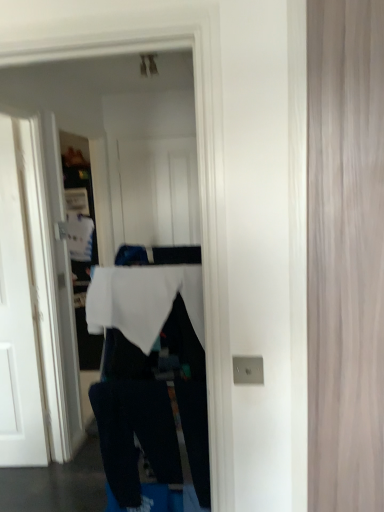
Question: From the image's perspective, is white matte tablecloth at center above wooden door at right?

Choices:
 (A) yes
 (B) no

Answer: (B)

Question: Can you confirm if white matte tablecloth at center is taller than wooden door at right?

Choices:
 (A) yes
 (B) no

Answer: (B)

Question: Is white matte tablecloth at center surrounding wooden door at right?

Choices:
 (A) no
 (B) yes

Answer: (A)

Question: Is wooden door at right at the back of white matte tablecloth at center?

Choices:
 (A) yes
 (B) no

Answer: (B)

Question: Considering the relative positions of white matte tablecloth at center and wooden door at right in the image provided, is white matte tablecloth at center behind wooden door at right?

Choices:
 (A) yes
 (B) no

Answer: (A)

Question: From the image's perspective, is white matte tablecloth at center beneath wooden door at right?

Choices:
 (A) yes
 (B) no

Answer: (A)

Question: Is wooden door at right wider than white painted wood door at left?

Choices:
 (A) no
 (B) yes

Answer: (A)

Question: From the image's perspective, would you say wooden door at right is shown under white painted wood door at left?

Choices:
 (A) no
 (B) yes

Answer: (A)

Question: Is wooden door at right outside of white painted wood door at left?

Choices:
 (A) no
 (B) yes

Answer: (B)

Question: Is wooden door at right at the left side of white painted wood door at left?

Choices:
 (A) yes
 (B) no

Answer: (B)

Question: From the image's perspective, is wooden door at right on white painted wood door at left?

Choices:
 (A) no
 (B) yes

Answer: (B)

Question: Does wooden door at right have a lesser width compared to white painted wood door at left?

Choices:
 (A) yes
 (B) no

Answer: (A)

Question: Is white fabric at center completely or partially inside white matte tablecloth at center?

Choices:
 (A) yes
 (B) no

Answer: (B)